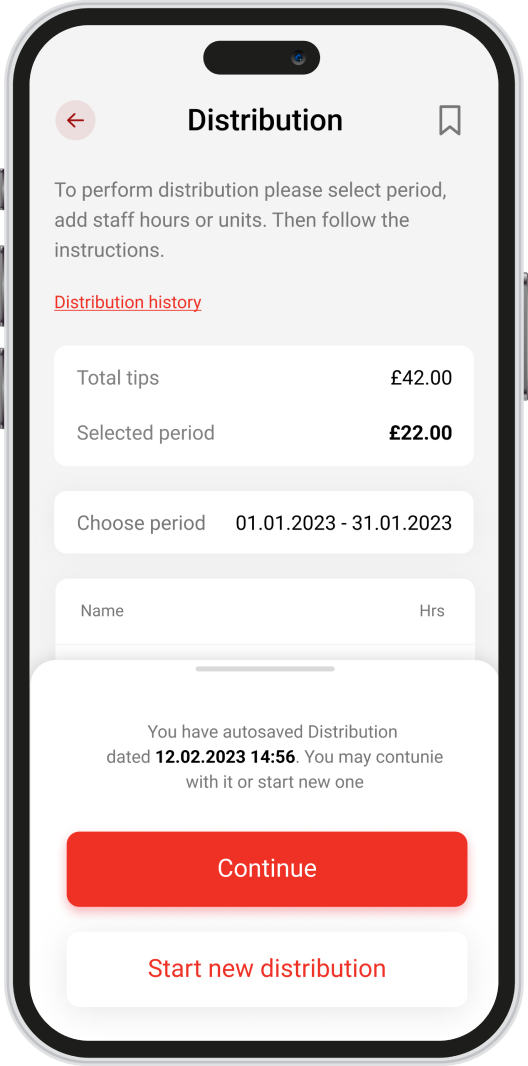
Locate an element on the screen. The width and height of the screenshot is (528, 1066). phone's volume up button is located at coordinates (2, 268).